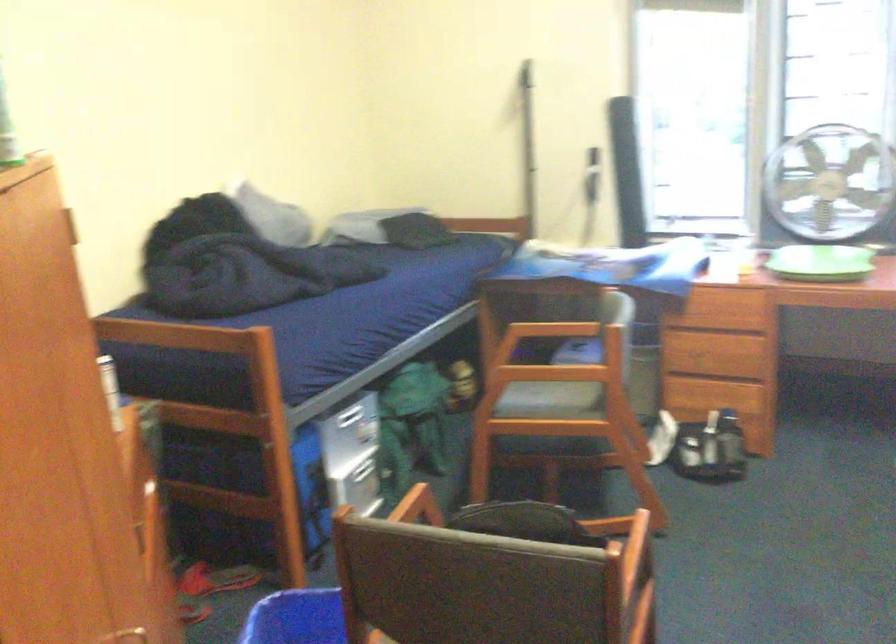
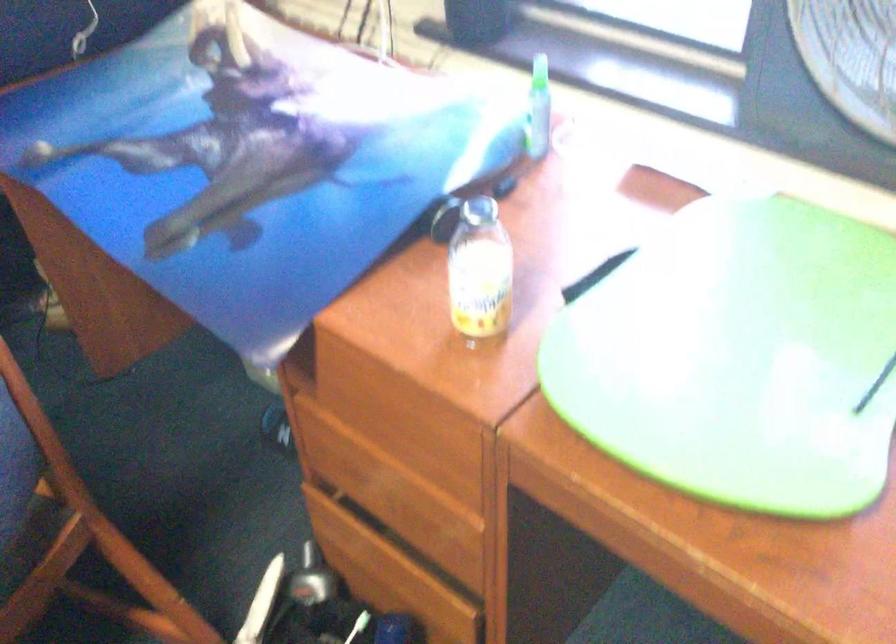
Locate, in the second image, the point that corresponds to [677,422] in the first image.

(311, 579)